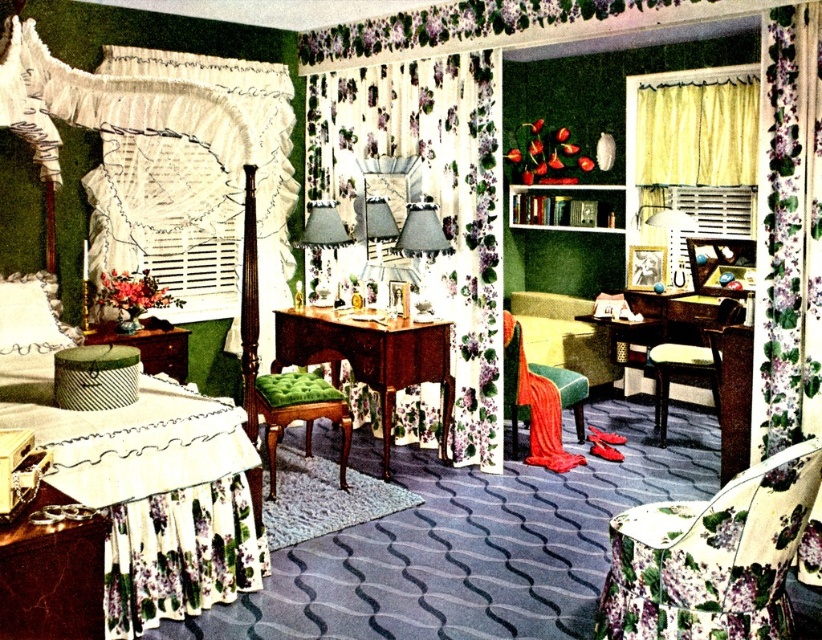
You are sitting on the floor and looking at the velvet green armchair at center and the white fabric pillow at lower left. Which object is higher from the floor?

The velvet green armchair at center is taller than the white fabric pillow at lower left, so the velvet green armchair at center is higher from the floor.

You are standing in the vintage bedroom and want to know how far you are from the point marked as point (328, 148). Can you determine the distance?

The point (328, 148) is 5.60 meters from viewer, so you are 5.60 meters away from the point marked as point (328, 148).

You are planning to place a large potted plant between the floral fabric armchair at lower right and the velvet green armchair at center. Considering their sizes, which armchair should the plant be closer to?

The floral fabric armchair at lower right is smaller than the velvet green armchair at center, so the plant should be placed closer to the larger velvet green armchair at center to maintain balance.